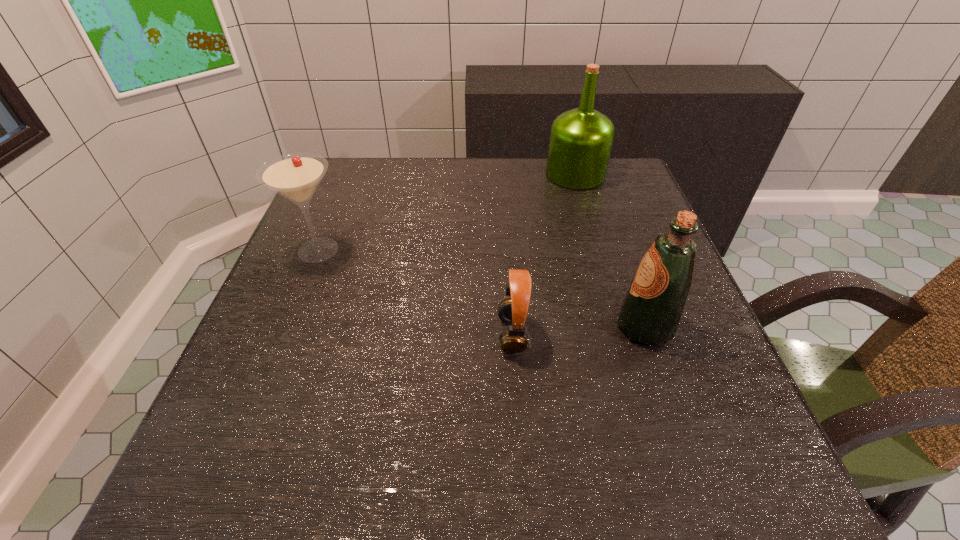
Image resolution: width=960 pixels, height=540 pixels. Find the location of `vacant area between the farthest object and the third nearest object`. vacant area between the farthest object and the third nearest object is located at coordinates (447, 212).

This screenshot has height=540, width=960. Find the location of `empty space that is in between the leftmost object and the nearer olive oil`. empty space that is in between the leftmost object and the nearer olive oil is located at coordinates (482, 289).

The height and width of the screenshot is (540, 960). In order to click on vacant area that lies between the third tallest object and the nearer olive oil in this screenshot , I will do `click(482, 289)`.

The height and width of the screenshot is (540, 960). What are the coordinates of `blank region between the farther olive oil and the second shortest object` in the screenshot? It's located at (447, 212).

Identify which object is the second closest to the third tallest object. Please provide its 2D coordinates. Your answer should be formatted as a tuple, i.e. [(x, y)], where the tuple contains the x and y coordinates of a point satisfying the conditions above.

[(581, 140)]

Locate an element on the screen. The height and width of the screenshot is (540, 960). the closest object to the nearer olive oil is located at coordinates (512, 310).

At what (x,y) coordinates should I click in order to perform the action: click on vacant point that satisfies the following two spatial constraints: 1. on the front side of the farther olive oil; 2. on the ear cups of the shortest object. Please return your answer as a coordinate pair (x, y). The height and width of the screenshot is (540, 960). Looking at the image, I should click on (622, 334).